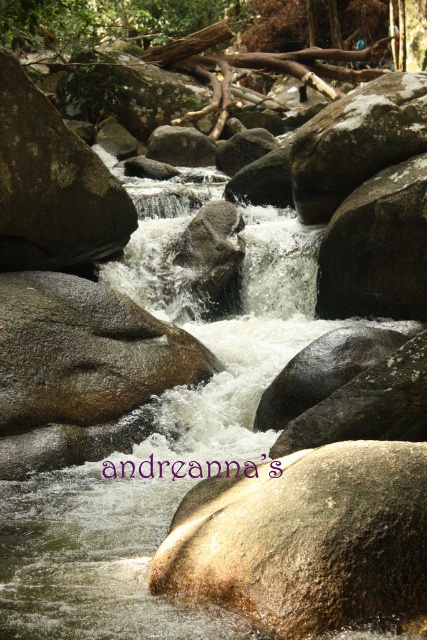
You are standing at the edge of the stream and see the brown rough rock at center and the smooth gray rock at center. Which rock is closer to the bottom of the stream?

The brown rough rock at center is positioned under the smooth gray rock at center, so it is closer to the bottom of the stream.

You are standing at the edge of the stream and notice a point marked at coordinates (306, 538). Which object from the scene does this point most likely correspond to?

The point at coordinates (306, 538) corresponds to the brown polished rock at center.

Based on the scene description, where is the brown rough rock at center located in terms of its 2D coordinates?

The brown rough rock at center is located at the 2D coordinates of point (84, 353).